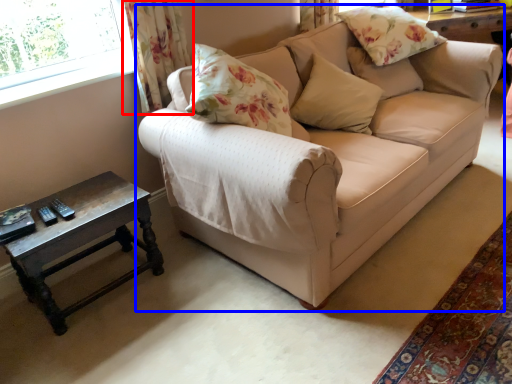
Question: Which object is closer to the camera taking this photo, curtain (highlighted by a red box) or studio couch (highlighted by a blue box)?

Choices:
 (A) curtain
 (B) studio couch

Answer: (B)